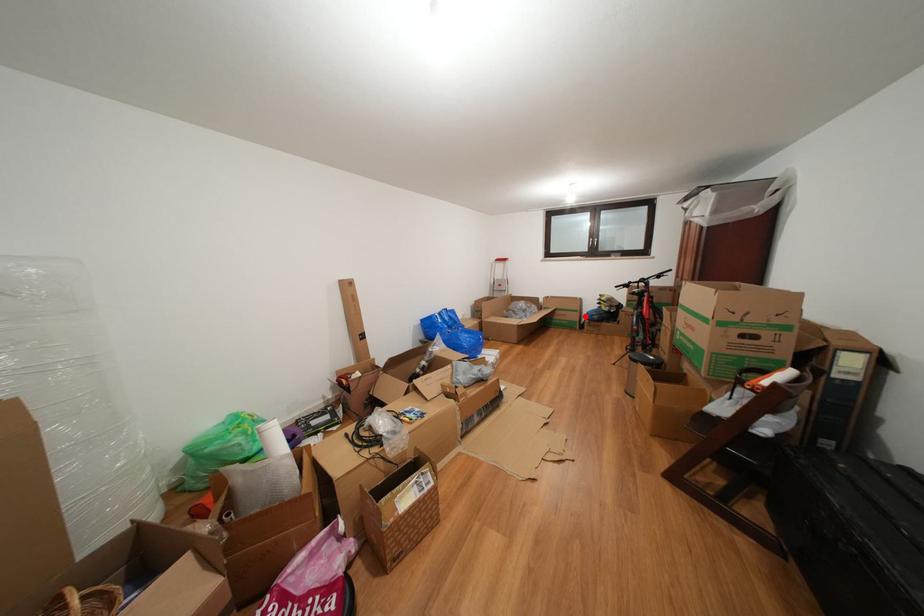
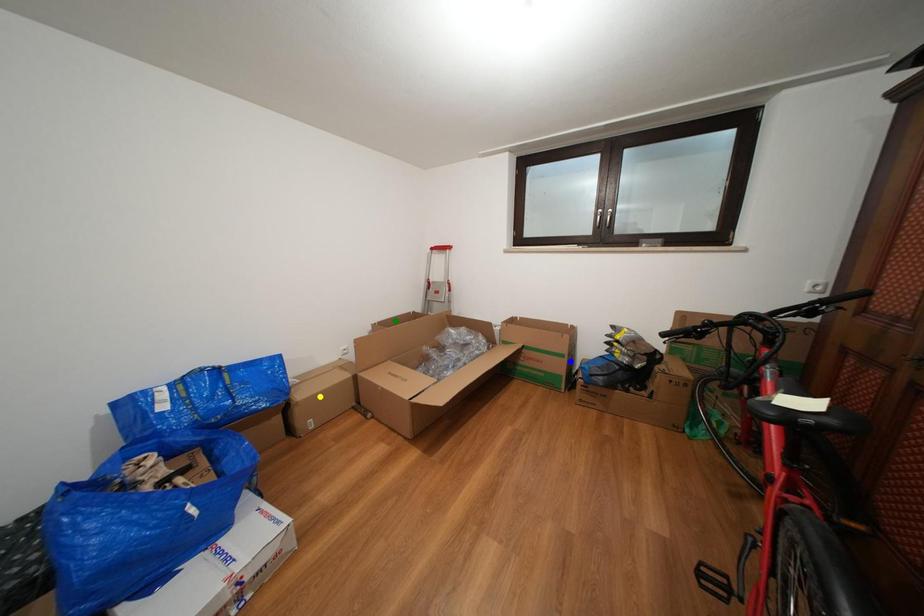
Question: I am providing you with two images of the same scene from different viewpoints. A red point is marked on the first image. You are given multiple points on the second image. Which spot in image 2 lines up with the point in image 1?

Choices:
 (A) yellow point
 (B) blue point
 (C) green point

Answer: (B)